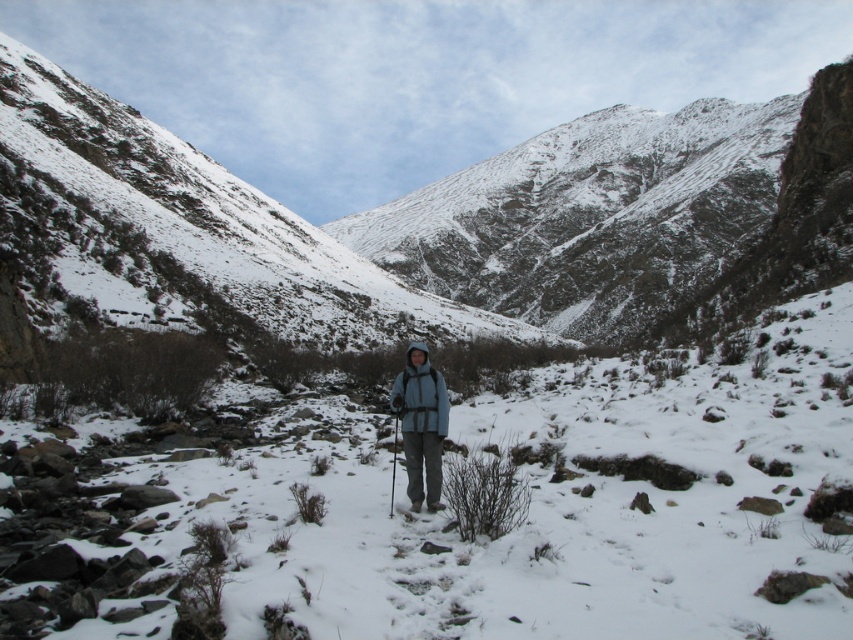
Looking at this image, you are a hiker preparing to take a photo of the mountains. You have a blue fleece jacket at center and a metallic silver ski pole at center in your viewfinder. Which object should you adjust your focus to ensure the ski pole is in the foreground?

To ensure the metallic silver ski pole at center is in the foreground, you should focus on the blue fleece jacket at center since the ski pole is behind it according to the description.

You are a hiker trying to determine if your backpack will fit between the blue fleece jacket at center and the metallic silver ski pole at center. The backpack is 1.2 meters wide. Can you fit it there?

The blue fleece jacket at center is wider than the metallic silver ski pole at center. However, the exact width of the space between them isn not provided, so it is uncertain if the 1.2 meter backpack will fit.

You are a hiker planning to move from your current position to a safe spot 10 meters away. You notice the blue fleece jacket at center and the metallic silver ski pole at center in your path. What is the shortest distance you can maintain between these two objects while moving towards your destination?

The shortest distance you can maintain between the blue fleece jacket at center and the metallic silver ski pole at center is 6.21 meters, as that is the fixed distance between them according to the scene description.